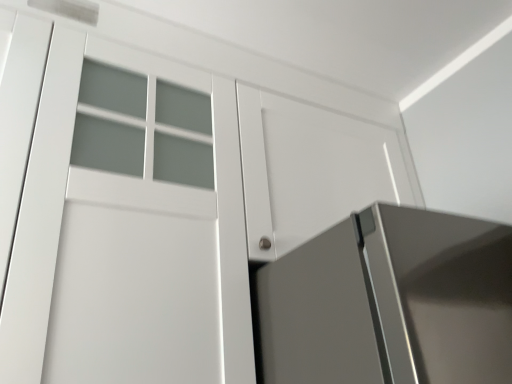
Question: Should I look upward or downward to see white matte door at center?

Choices:
 (A) up
 (B) down

Answer: (A)